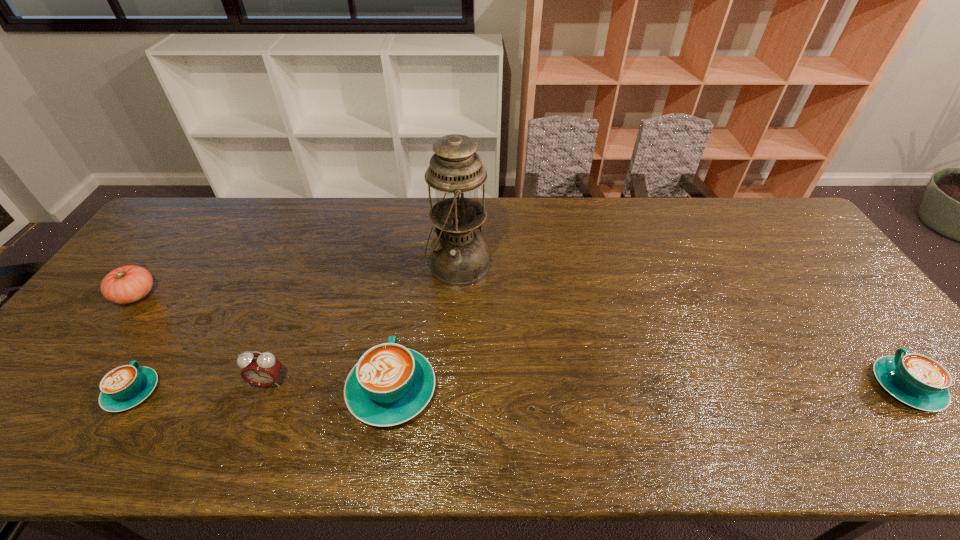
The height and width of the screenshot is (540, 960). Find the location of `blank space located 0.250m with the handle on the right side of the second cappuccino from left to right`. blank space located 0.250m with the handle on the right side of the second cappuccino from left to right is located at coordinates (409, 283).

The height and width of the screenshot is (540, 960). Find the location of `vacant space located 0.070m with the handle on the right side of the second cappuccino from left to right`. vacant space located 0.070m with the handle on the right side of the second cappuccino from left to right is located at coordinates (401, 332).

Locate an element on the screen. The width and height of the screenshot is (960, 540). vacant space situated with the handle on the right side of the second cappuccino from left to right is located at coordinates (412, 262).

Where is `vacant space located 0.370m on the back of the tomato`? The height and width of the screenshot is (540, 960). vacant space located 0.370m on the back of the tomato is located at coordinates (x=203, y=206).

This screenshot has width=960, height=540. Find the location of `vacant space positioned on the left of the tallest object`. vacant space positioned on the left of the tallest object is located at coordinates (396, 266).

Where is `alarm clock that is at the near edge`? The image size is (960, 540). alarm clock that is at the near edge is located at coordinates (261, 369).

Where is `object that is at the left edge`? The image size is (960, 540). object that is at the left edge is located at coordinates (127, 284).

Identify the location of vacant space at the far edge of the desktop. The width and height of the screenshot is (960, 540). click(384, 220).

Find the location of a particular element. vacant space at the near edge is located at coordinates (280, 380).

At what (x,y) coordinates should I click in order to perform the action: click on vacant space at the left edge. Please return your answer as a coordinate pair (x, y). The height and width of the screenshot is (540, 960). Looking at the image, I should click on (71, 369).